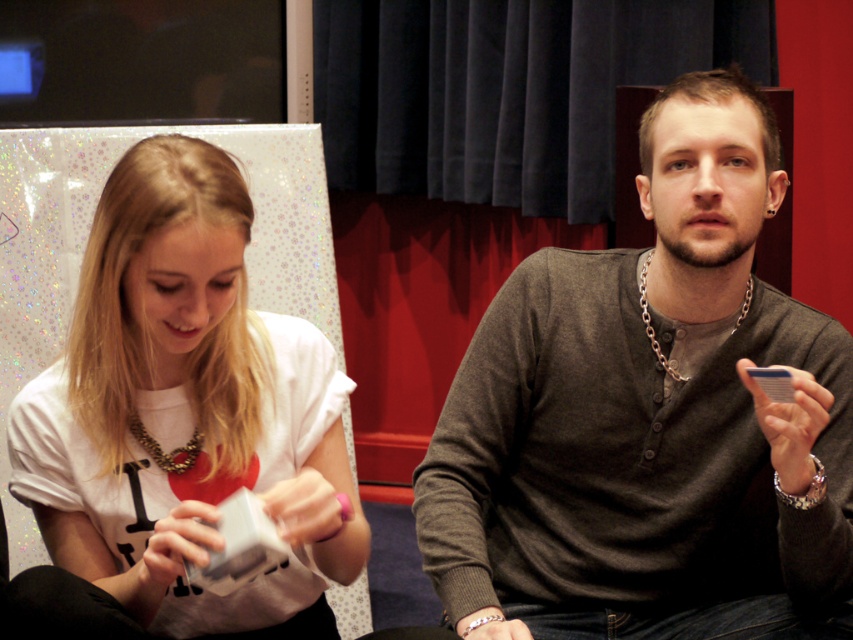
Is point (633, 592) farther from camera compared to point (747, 289)?

Yes.

Does matte gray sweater at center have a lesser height compared to gold chain necklace at center?

Incorrect, matte gray sweater at center's height does not fall short of gold chain necklace at center's.

Is point (483, 500) positioned after point (643, 321)?

Yes.

Identify the location of matte gray sweater at center. (646, 413).

Does white matte t-shirt at center appear on the left side of gold chain necklace at center?

Correct, you'll find white matte t-shirt at center to the left of gold chain necklace at center.

Can you confirm if white matte t-shirt at center is positioned to the right of gold chain necklace at center?

In fact, white matte t-shirt at center is to the left of gold chain necklace at center.

Find the location of a particular element. white matte t-shirt at center is located at coordinates (186, 412).

The width and height of the screenshot is (853, 640). In order to click on white matte t-shirt at center in this screenshot , I will do `click(186, 412)`.

Which of these two, white matte t-shirt at center or gold textured necklace at center, stands taller?

white matte t-shirt at center

Is point (125, 216) positioned behind point (141, 436)?

No, (125, 216) is closer to viewer.

Is point (189, 528) behind point (177, 465)?

No, (189, 528) is closer to viewer.

Where is `white matte t-shirt at center`? This screenshot has height=640, width=853. white matte t-shirt at center is located at coordinates (186, 412).